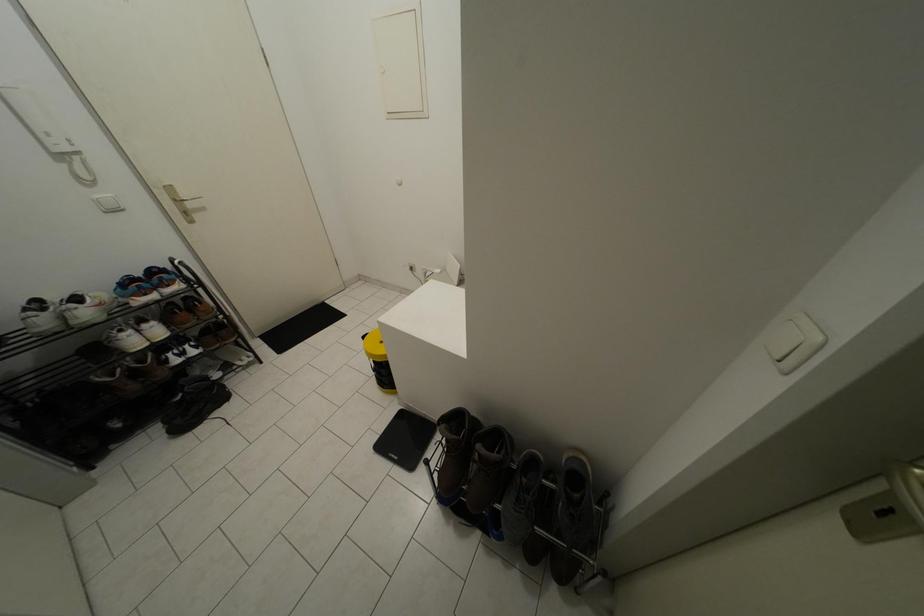
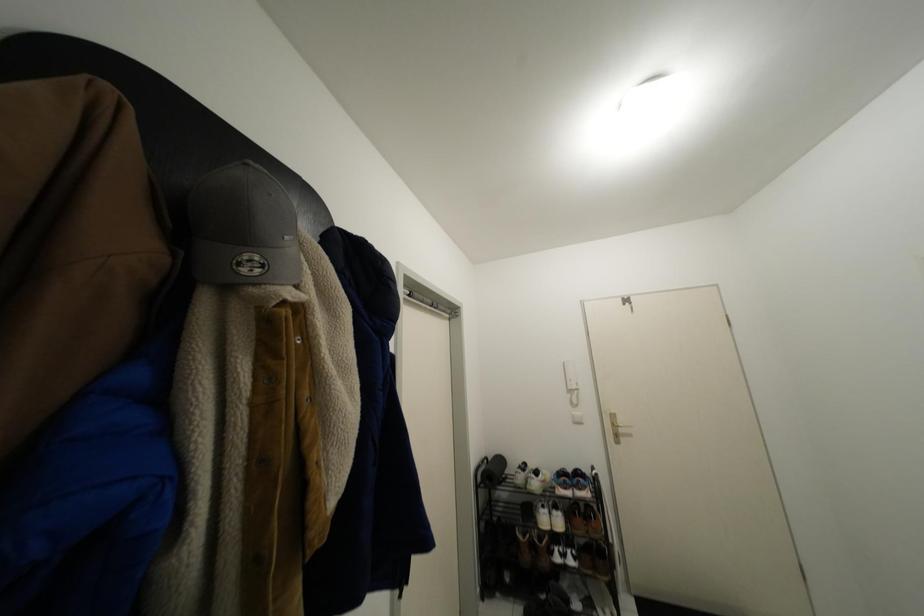
First-person continuous shooting, in which direction is the camera rotating?

The rotation direction of the camera is left-up.